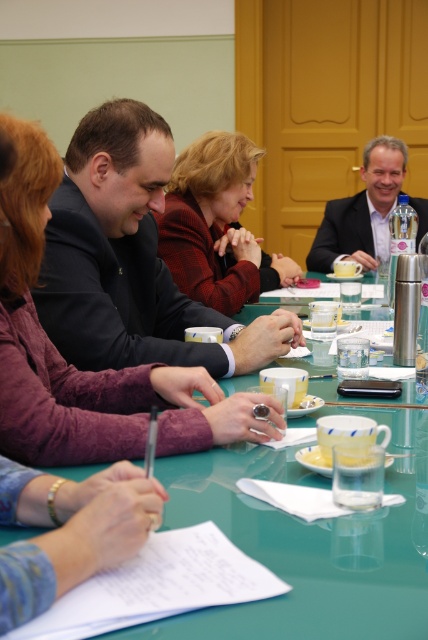
Question: Which point appears farthest from the camera in this image?

Choices:
 (A) (243, 246)
 (B) (142, 346)
 (C) (166, 477)
 (D) (344, 221)

Answer: (D)

Question: Which object appears farthest from the camera in this image?

Choices:
 (A) matte black suit at upper right
 (B) green glass table at center
 (C) red woolen sweater at center

Answer: (A)

Question: Can you confirm if green glass table at center is positioned above red woolen sweater at center?

Choices:
 (A) no
 (B) yes

Answer: (A)

Question: Which of these objects is positioned farthest from the red woolen sweater at center?

Choices:
 (A) green glass table at center
 (B) black suit at center

Answer: (A)

Question: Does green glass table at center lie behind black suit at center?

Choices:
 (A) no
 (B) yes

Answer: (A)

Question: Can you confirm if green glass table at center is positioned below red woolen sweater at center?

Choices:
 (A) yes
 (B) no

Answer: (A)